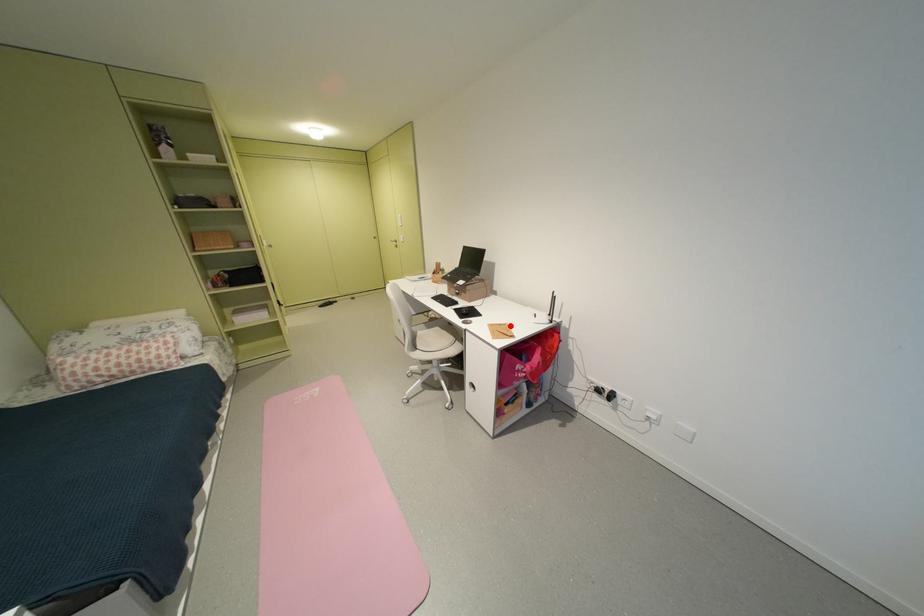
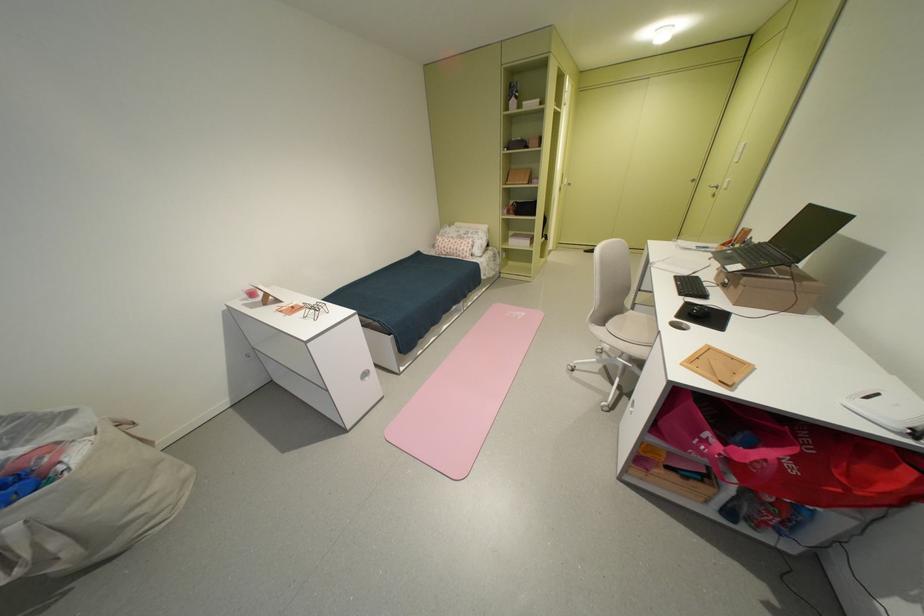
Find the pixel in the second image that matches the highlighted location in the first image.

(743, 360)